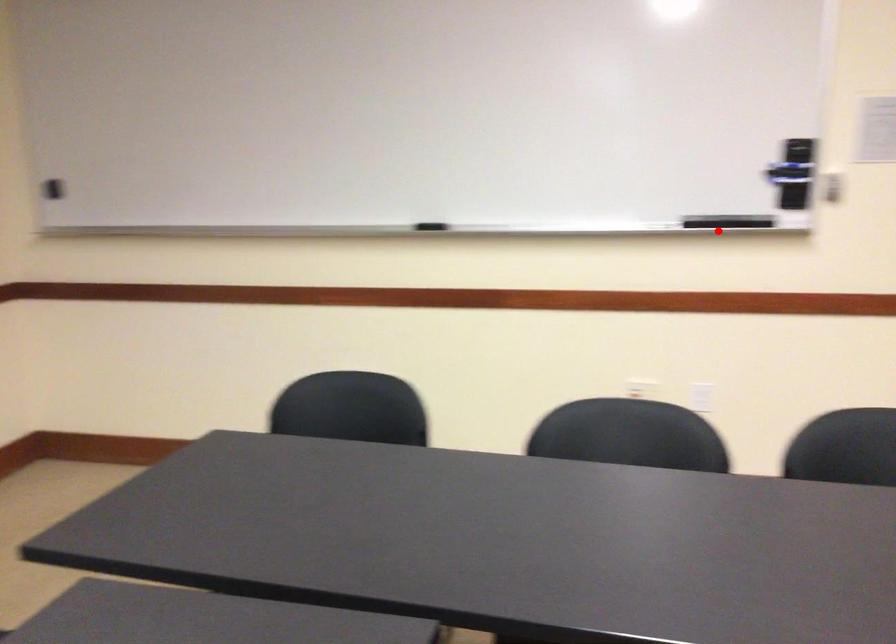
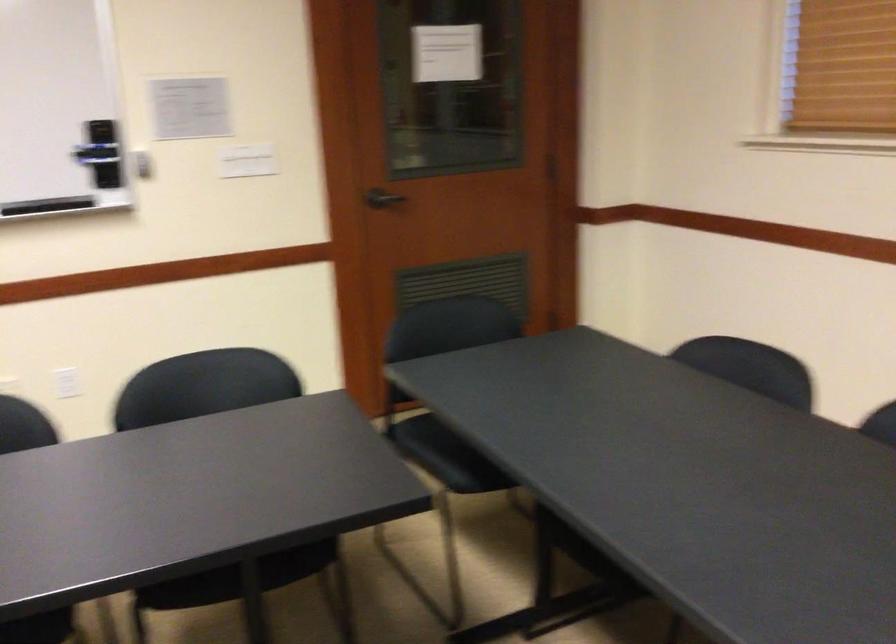
Where in the second image is the point corresponding to the highlighted location from the first image?

(46, 205)